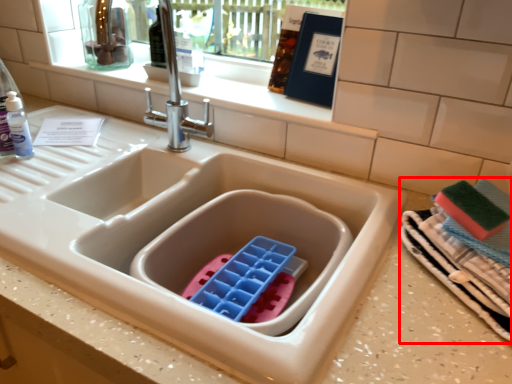
Question: From the image, what is the correct spatial relationship of laundry (annotated by the red box) in relation to tap?

Choices:
 (A) left
 (B) right

Answer: (B)